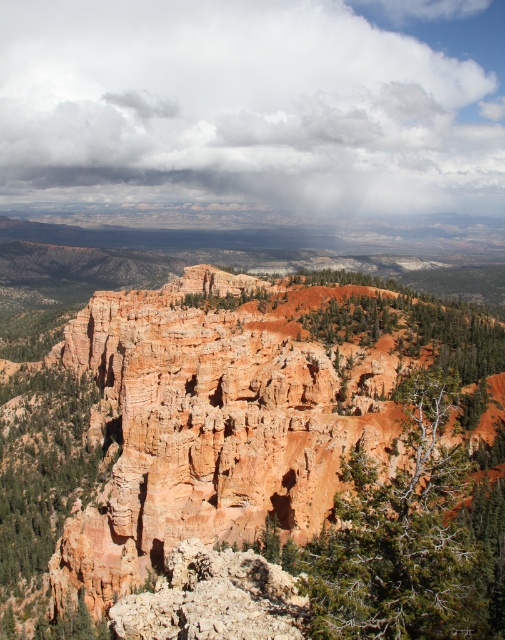
Who is more distant from viewer, (260,102) or (204,632)?

The point (260,102) is more distant.

Can you confirm if cloudy white cloud at upper center is smaller than rusty rock formation at center?

No.

Who is more forward, (310, 83) or (205, 572)?

Point (205, 572) is more forward.

This screenshot has width=505, height=640. In order to click on cloudy white cloud at upper center in this screenshot , I will do `click(255, 104)`.

Which of these two, green textured tree at center or green matte tree at center, stands taller?

With more height is green textured tree at center.

Which is below, green textured tree at center or green matte tree at center?

green textured tree at center is below.

Between point (438, 634) and point (374, 314), which one is positioned behind?

Positioned behind is point (374, 314).

At what (x,y) coordinates should I click in order to perform the action: click on green textured tree at center. Please return your answer as a coordinate pair (x, y). Image resolution: width=505 pixels, height=640 pixels. Looking at the image, I should click on [x=411, y=538].

Which of these two, cloudy white cloud at upper center or green textured tree at center, stands taller?

Standing taller between the two is cloudy white cloud at upper center.

Is point (259, 182) more distant than point (336, 602)?

Yes, point (259, 182) is behind point (336, 602).

In order to click on cloudy white cloud at upper center in this screenshot , I will do `click(255, 104)`.

You are a GUI agent. You are given a task and a screenshot of the screen. Output one action in this format:
    pyautogui.click(x=<x>, y=<y>)
    Task: Click on the cloudy white cloud at upper center
    Image resolution: width=505 pixels, height=640 pixels.
    Given the screenshot: What is the action you would take?
    pyautogui.click(x=255, y=104)